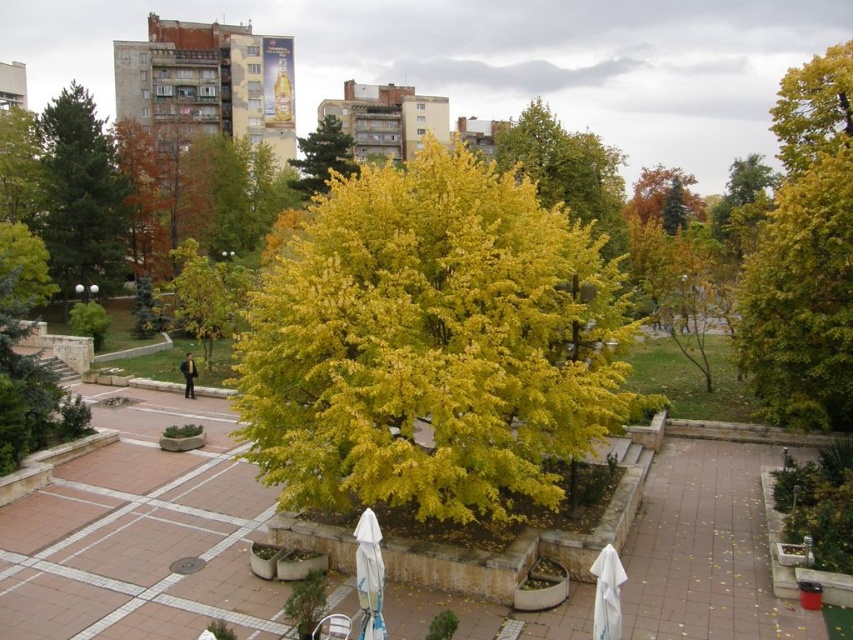
Question: Is green matte tree at left below yellow-green foliage at center?

Choices:
 (A) yes
 (B) no

Answer: (A)

Question: Which of the following is the closest to the observer?

Choices:
 (A) yellow-green foliage at center
 (B) orange matte tree at upper right

Answer: (A)

Question: Is green matte tree at left below orange matte tree at upper right?

Choices:
 (A) no
 (B) yes

Answer: (B)

Question: Does green matte tree at left have a greater width compared to orange matte tree at upper right?

Choices:
 (A) yes
 (B) no

Answer: (B)

Question: Which object is farther from the camera taking this photo?

Choices:
 (A) yellow leafy tree at center
 (B) white fabric umbrella at lower center
 (C) yellow-green leafy tree at center-left
 (D) green matte tree at left

Answer: (D)

Question: Which object is farther from the camera taking this photo?

Choices:
 (A) yellow leafy tree at center
 (B) white fabric umbrella at lower center

Answer: (A)